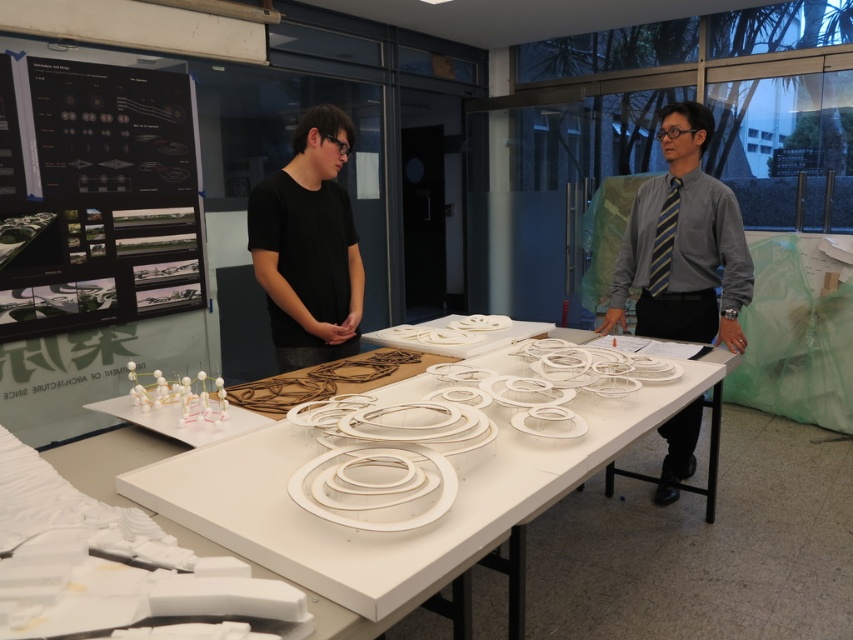
You are an architect observing the scene. You notice the white matte sculpture at center and the gray shirt and tie at center. Based on their positions, which object is closer to the ground?

The white matte sculpture at center is located below the gray shirt and tie at center, so it is closer to the ground.

You are an architect observing the scene. You need to reach both the white matte sculpture at center and the gray shirt and tie at center. Which object will you physically touch first when moving forward from your current position?

The white matte sculpture at center is closer to the viewer than the gray shirt and tie at center, so you will touch the white matte sculpture at center first.